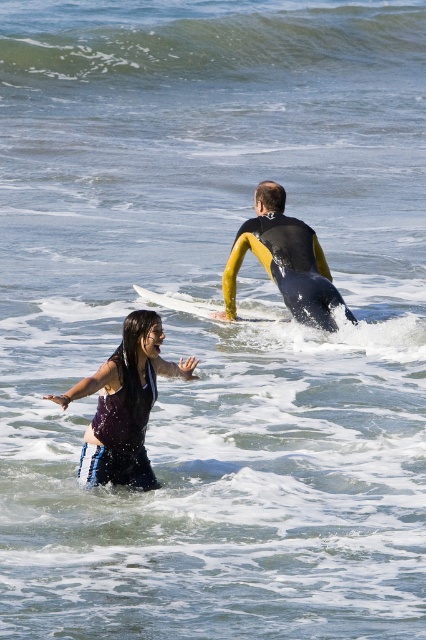
You are a photographer trying to capture a photo of both the yellow neoprene wetsuit at center and the white foam surfboard at center in the same frame. Based on their distance, can you fit both into the shot without zooming in?

The yellow neoprene wetsuit at center and the white foam surfboard at center are 1.17 meters apart. Since the distance between them is relatively small, you can likely fit both into the shot without zooming in.

You are a photographer trying to capture both the dark purple wetsuit at lower left and the yellow neoprene wetsuit at center in the same frame. Based on their positions, which one is closer to the bottom of the image?

The dark purple wetsuit at lower left is located below the yellow neoprene wetsuit at center, so it is closer to the bottom of the image.

You are a photographer standing at the ocean edge. You want to capture a closeup shot of the yellow neoprene wetsuit at center. Given that your camera has a maximum zoom range of 50 feet, will you be able to take the photo without moving closer?

The yellow neoprene wetsuit at center is 52.86 feet away from the camera. Since the camera can only zoom up to 50 feet, you will not be able to capture a clear closeup without moving closer.